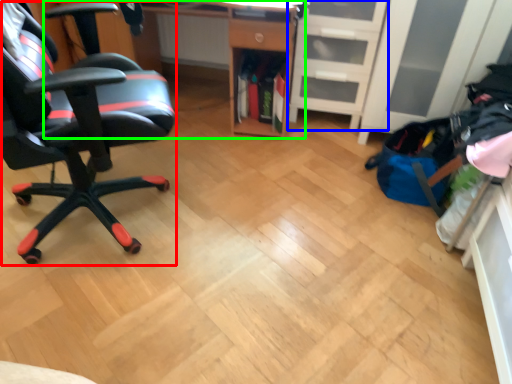
Question: Considering the real-world distances, which object is closest to chair (highlighted by a red box)? file cabinet (highlighted by a blue box) or desk (highlighted by a green box).

Choices:
 (A) file cabinet
 (B) desk

Answer: (B)